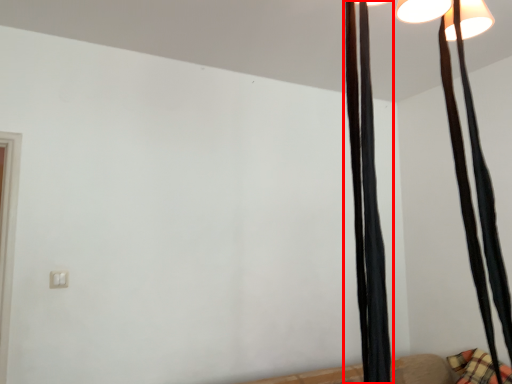
Question: From the image, what is the correct spatial relationship of curtain (annotated by the red box) in relation to curtain?

Choices:
 (A) right
 (B) left

Answer: (B)